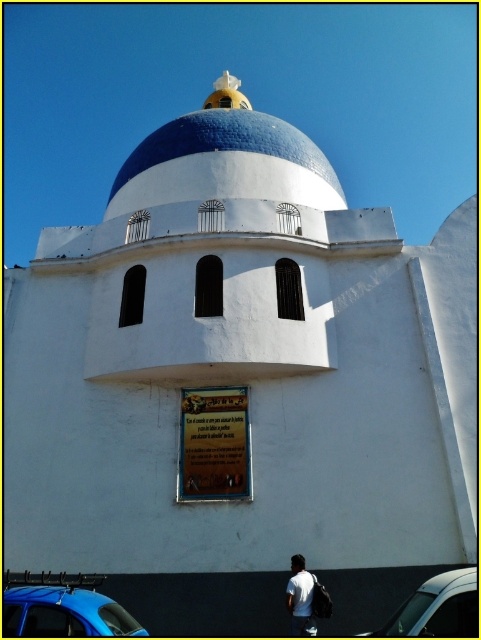
Measure the distance between blue tiled dome at upper center and metallic silver car at lower right.

A distance of 19.75 meters exists between blue tiled dome at upper center and metallic silver car at lower right.

At what (x,y) coordinates should I click in order to perform the action: click on blue tiled dome at upper center. Please return your answer as a coordinate pair (x, y). Looking at the image, I should click on (226, 160).

Does metallic blue car at lower left appear on the left side of metallic silver car at lower right?

Correct, you'll find metallic blue car at lower left to the left of metallic silver car at lower right.

Can you confirm if metallic blue car at lower left is positioned below metallic silver car at lower right?

Yes, metallic blue car at lower left is below metallic silver car at lower right.

Find the location of a particular element. metallic blue car at lower left is located at coordinates (63, 608).

The height and width of the screenshot is (640, 481). Identify the location of metallic blue car at lower left. (63, 608).

Does metallic silver car at lower right come in front of white matte shirt at lower center?

Yes, metallic silver car at lower right is closer to the viewer.

Is metallic silver car at lower right shorter than white matte shirt at lower center?

No, metallic silver car at lower right is not shorter than white matte shirt at lower center.

Which is in front, point (465, 620) or point (294, 632)?

Point (465, 620) is more forward.

This screenshot has height=640, width=481. I want to click on metallic silver car at lower right, so click(x=437, y=609).